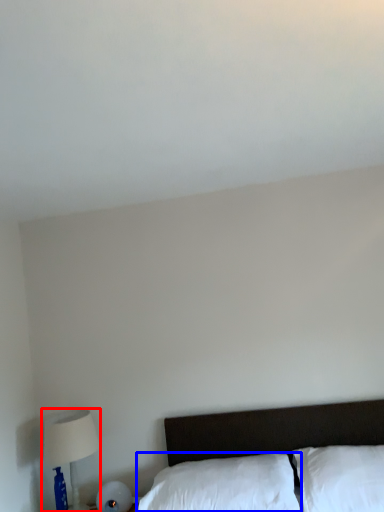
Question: Among these objects, which one is farthest to the camera, table lamp (highlighted by a red box) or pillow (highlighted by a blue box)?

Choices:
 (A) table lamp
 (B) pillow

Answer: (A)